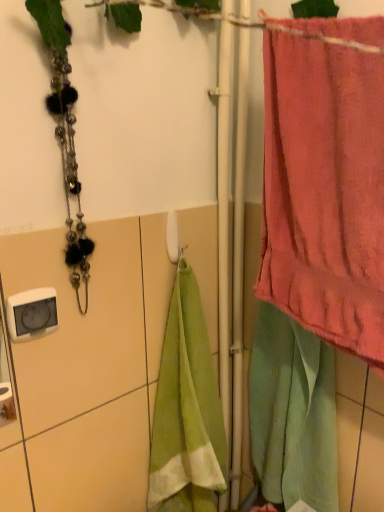
Question: Does white plastic towel bar at center have a greater width compared to pink terry cloth towel at right?

Choices:
 (A) no
 (B) yes

Answer: (A)

Question: Is the position of white plastic towel bar at center more distant than that of pink terry cloth towel at right?

Choices:
 (A) yes
 (B) no

Answer: (A)

Question: Does white plastic towel bar at center have a smaller size compared to pink terry cloth towel at right?

Choices:
 (A) yes
 (B) no

Answer: (A)

Question: Is white plastic towel bar at center far from pink terry cloth towel at right?

Choices:
 (A) no
 (B) yes

Answer: (A)

Question: Would you say white plastic towel bar at center is outside pink terry cloth towel at right?

Choices:
 (A) no
 (B) yes

Answer: (B)

Question: Considering the relative sizes of white plastic towel bar at center and pink terry cloth towel at right in the image provided, is white plastic towel bar at center bigger than pink terry cloth towel at right?

Choices:
 (A) no
 (B) yes

Answer: (A)

Question: Considering the relative sizes of pink terry cloth towel at right and white plastic towel bar at center in the image provided, is pink terry cloth towel at right thinner than white plastic towel bar at center?

Choices:
 (A) yes
 (B) no

Answer: (B)

Question: Is pink terry cloth towel at right positioned before white plastic towel bar at center?

Choices:
 (A) no
 (B) yes

Answer: (B)

Question: Could you tell me if pink terry cloth towel at right is turned towards white plastic towel bar at center?

Choices:
 (A) yes
 (B) no

Answer: (B)

Question: From the image's perspective, is pink terry cloth towel at right located above white plastic towel bar at center?

Choices:
 (A) yes
 (B) no

Answer: (A)

Question: Can you confirm if pink terry cloth towel at right is shorter than white plastic towel bar at center?

Choices:
 (A) yes
 (B) no

Answer: (B)

Question: Is pink terry cloth towel at right completely or partially outside of white plastic towel bar at center?

Choices:
 (A) no
 (B) yes

Answer: (B)

Question: Which is correct: pink terry cloth towel at right is inside white plastic towel bar at center, or outside of it?

Choices:
 (A) inside
 (B) outside

Answer: (B)